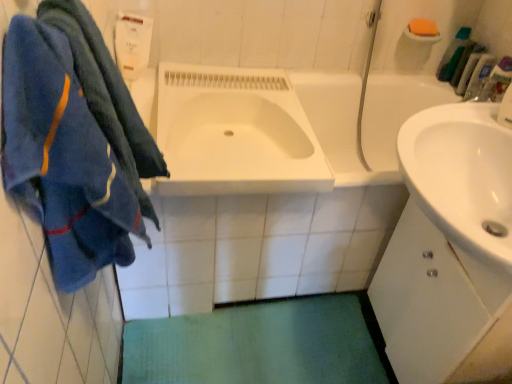
Question: Is orange sponge at upper right beside green plastic toothbrush at upper right, positioned as the third toiletry in bottom-to-top order?

Choices:
 (A) yes
 (B) no

Answer: (B)

Question: Does orange sponge at upper right have a lesser width compared to green plastic toothbrush at upper right, positioned as the third toiletry in bottom-to-top order?

Choices:
 (A) yes
 (B) no

Answer: (B)

Question: Can you confirm if orange sponge at upper right is wider than green plastic toothbrush at upper right, positioned as the third toiletry in bottom-to-top order?

Choices:
 (A) yes
 (B) no

Answer: (A)

Question: Are orange sponge at upper right and green plastic toothbrush at upper right, positioned as the third toiletry in bottom-to-top order, far apart?

Choices:
 (A) yes
 (B) no

Answer: (B)

Question: From the image's perspective, is orange sponge at upper right located beneath green plastic toothbrush at upper right, marked as the first toiletry in a top-to-bottom arrangement?

Choices:
 (A) yes
 (B) no

Answer: (B)

Question: Is orange sponge at upper right shorter than green plastic toothbrush at upper right, marked as the first toiletry in a top-to-bottom arrangement?

Choices:
 (A) no
 (B) yes

Answer: (B)

Question: Is white matte cabinet at right surrounded by orange sponge at upper right?

Choices:
 (A) yes
 (B) no

Answer: (B)

Question: Considering the relative sizes of orange sponge at upper right and white matte cabinet at right in the image provided, is orange sponge at upper right taller than white matte cabinet at right?

Choices:
 (A) yes
 (B) no

Answer: (B)

Question: Is orange sponge at upper right to the right of white matte cabinet at right from the viewer's perspective?

Choices:
 (A) no
 (B) yes

Answer: (B)

Question: Is orange sponge at upper right looking in the opposite direction of white matte cabinet at right?

Choices:
 (A) no
 (B) yes

Answer: (A)

Question: Is orange sponge at upper right bigger than white matte cabinet at right?

Choices:
 (A) no
 (B) yes

Answer: (A)

Question: Considering the relative positions of orange sponge at upper right and white matte cabinet at right in the image provided, is orange sponge at upper right to the left of white matte cabinet at right from the viewer's perspective?

Choices:
 (A) yes
 (B) no

Answer: (B)

Question: Can green plastic toothbrush at upper right, positioned as the third toiletry in bottom-to-top order, be found inside green plastic bottles at upper right, placed as the second toiletry when sorted from bottom to top?

Choices:
 (A) yes
 (B) no

Answer: (B)